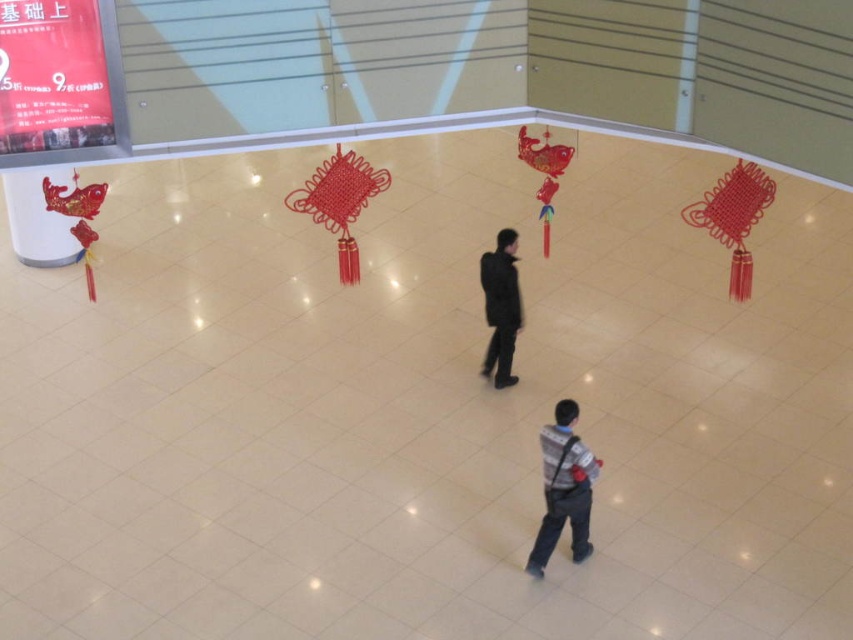
Between striped sweater at lower right and black matte jacket at center, which one appears on the right side from the viewer's perspective?

striped sweater at lower right is more to the right.

Who is shorter, striped sweater at lower right or black matte jacket at center?

striped sweater at lower right is shorter.

Is point (569, 452) positioned in front of point (495, 285)?

Yes, it is.

Locate an element on the screen. This screenshot has width=853, height=640. striped sweater at lower right is located at coordinates (x=563, y=486).